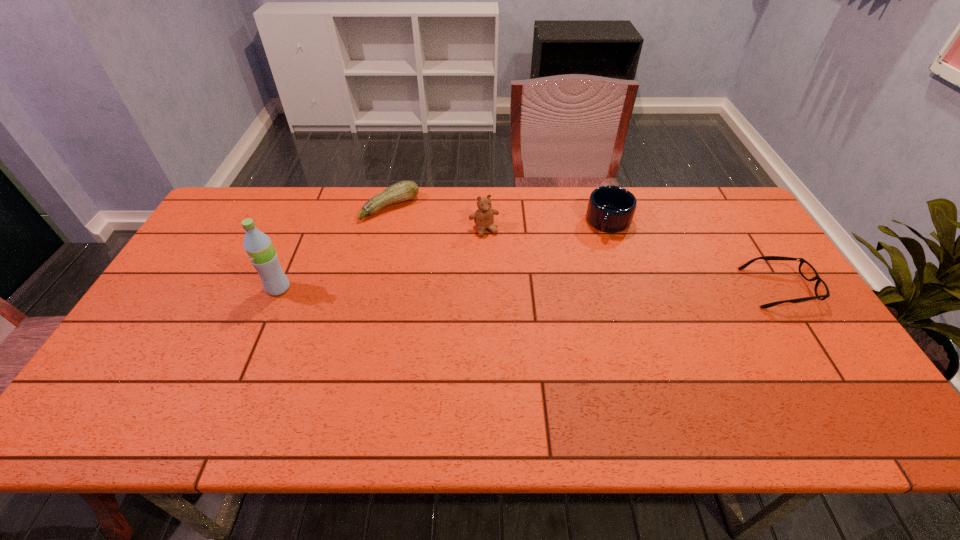
Where is `water bottle`? This screenshot has width=960, height=540. water bottle is located at coordinates (258, 246).

Find the location of a particular element. the tallest object is located at coordinates (258, 246).

Locate an element on the screen. The height and width of the screenshot is (540, 960). spectacles is located at coordinates (807, 271).

Find the location of a particular element. the rightmost object is located at coordinates (807, 271).

Image resolution: width=960 pixels, height=540 pixels. What are the coordinates of `teddy bear` in the screenshot? It's located at pyautogui.click(x=484, y=216).

Where is `the fourth shortest object`? the fourth shortest object is located at coordinates (484, 216).

The image size is (960, 540). In order to click on the second object from left to right in this screenshot , I will do `click(406, 190)`.

Find the location of a particular element. Image resolution: width=960 pixels, height=540 pixels. zucchini is located at coordinates (406, 190).

Identify the location of mug. This screenshot has width=960, height=540. tap(611, 209).

At what (x,y) coordinates should I click in order to perform the action: click on the second object from right to left. Please return your answer as a coordinate pair (x, y). Image resolution: width=960 pixels, height=540 pixels. Looking at the image, I should click on (611, 209).